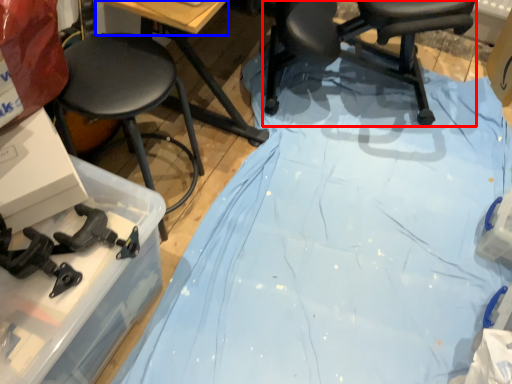
Question: Which object appears farthest to the camera in this image, chair (highlighted by a red box) or table top (highlighted by a blue box)?

Choices:
 (A) chair
 (B) table top

Answer: (A)